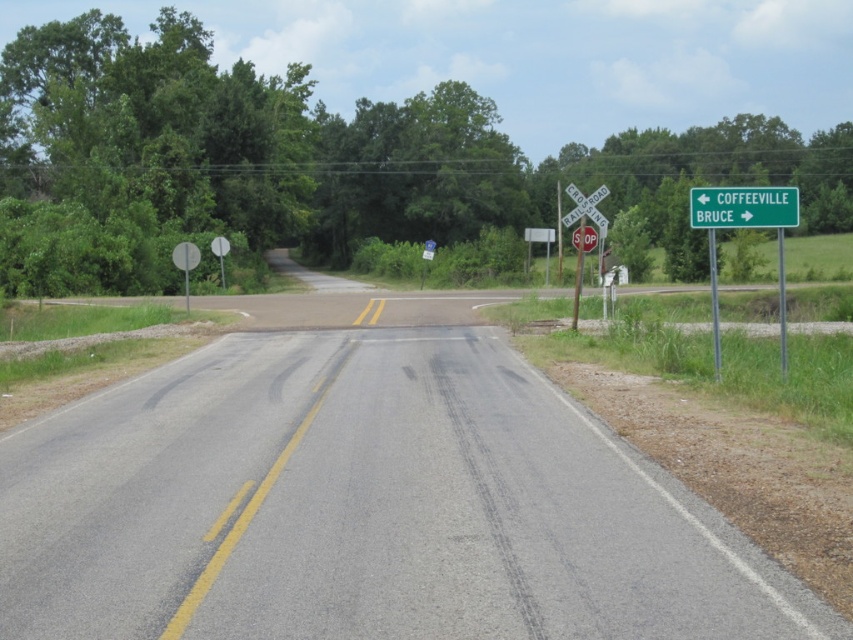
Looking at this image, you are driving a car and need to stay on the asphalt road at center. There is a green metallic sign at upper right nearby. Which direction should you turn to keep the sign on your right side while staying on the road?

To keep the green metallic sign at upper right on your right side while staying on the asphalt road at center, you should turn to the left since the asphalt road at center is to the left of the green metallic sign at upper right.